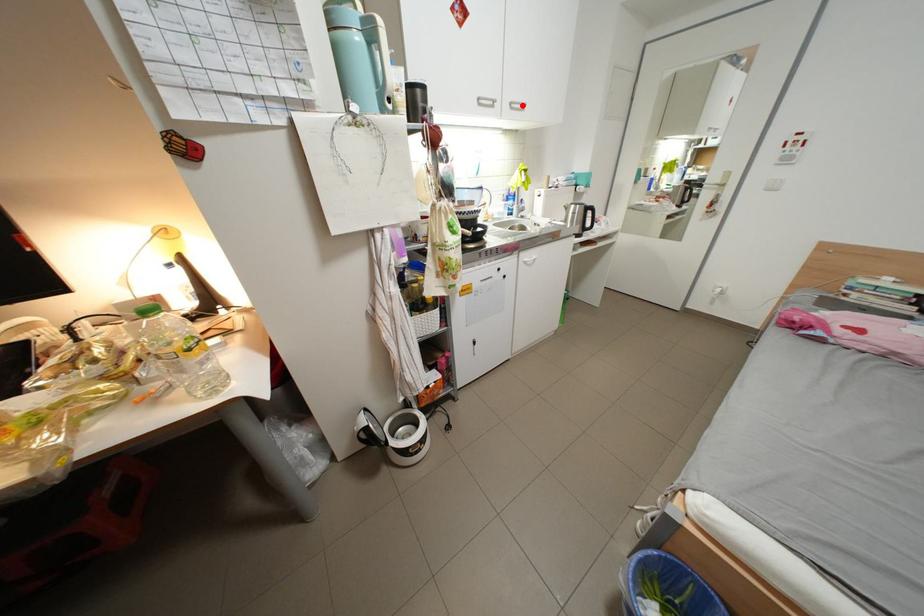
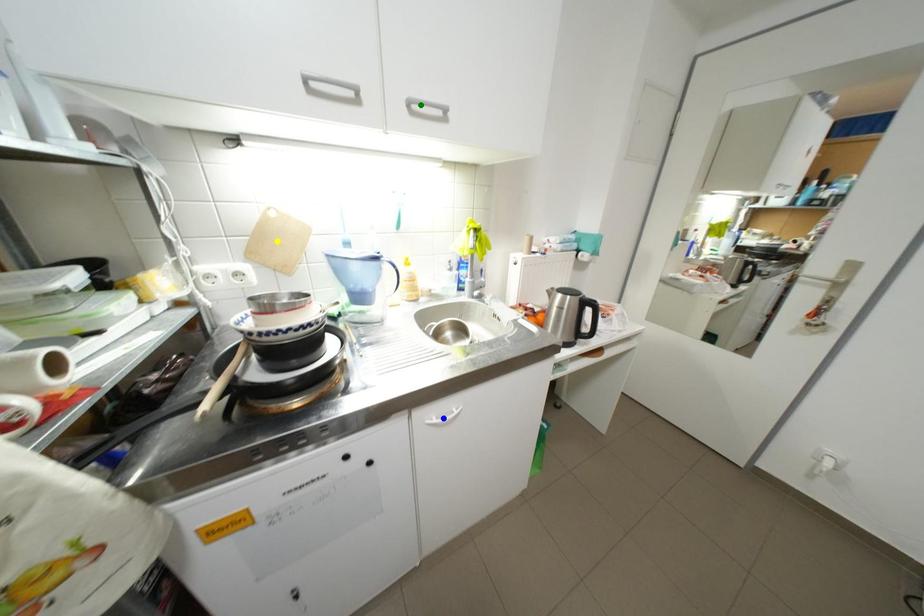
Question: I am providing you with two images of the same scene from different viewpoints. A red point is marked on the first image. You are given multiple points on the second image. Can you choose the point in image 2 that corresponds to the point in image 1?

Choices:
 (A) green point
 (B) yellow point
 (C) blue point

Answer: (A)